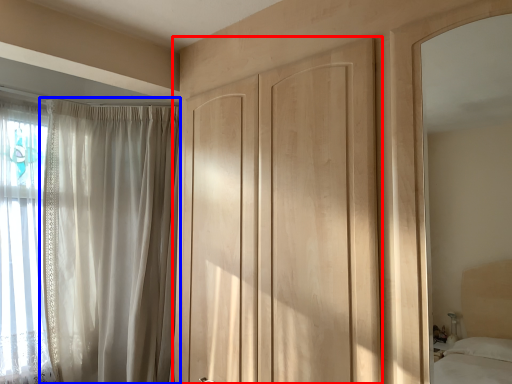
Question: Which point is closer to the camera, door (highlighted by a red box) or curtain (highlighted by a blue box)?

Choices:
 (A) door
 (B) curtain

Answer: (A)